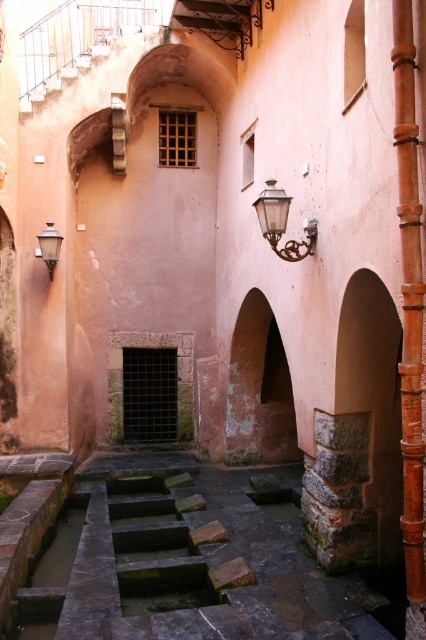
Based on the photo, you are standing in the courtyard and want to take a photo of the point at coordinates (365, 624). If your camera has a focal length of 50mm and you are 5.08 meters away from the point, what is the approximate angle of view required to capture the entire point in the frame?

The point at coordinates (365, 624) is 5.08 meters away from the camera. To calculate the angle of view, you can use the formula angle of view in radians equals 2 times arctangent of half the subject width divided by distance. However, since the point is a single point with no width, the angle of view required would effectively be zero. Therefore, any standard camera angle would easily capture the point as it is a single point.